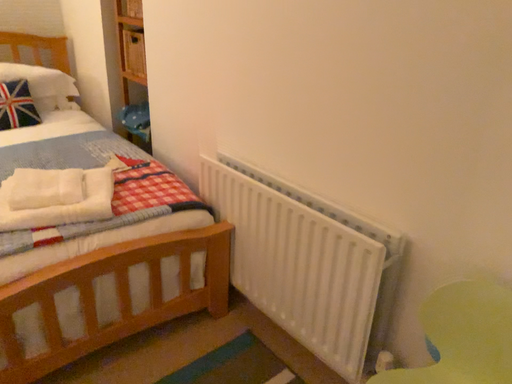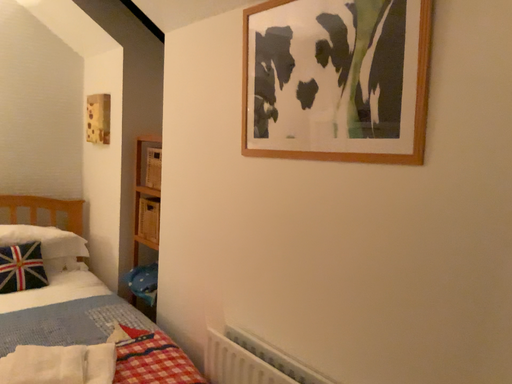
Question: Which way did the camera rotate in the video?

Choices:
 (A) rotated downward
 (B) rotated upward

Answer: (B)